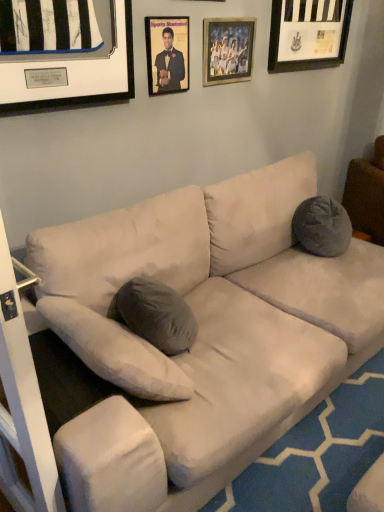
Question: Could you tell me if wooden picture frame at upper center, the second picture frame positioned from the left, is turned towards matte black frame at upper center, which ranks as the 1th picture frame in left-to-right order?

Choices:
 (A) no
 (B) yes

Answer: (A)

Question: Can you confirm if wooden picture frame at upper center, the second picture frame positioned from the left, is shorter than matte black frame at upper center, which is the 3th picture frame in right-to-left order?

Choices:
 (A) no
 (B) yes

Answer: (B)

Question: From the image's perspective, is wooden picture frame at upper center, which appears as the second picture frame when viewed from the right, beneath matte black frame at upper center, which is the 3th picture frame in right-to-left order?

Choices:
 (A) yes
 (B) no

Answer: (B)

Question: Is matte black frame at upper center, which ranks as the 1th picture frame in left-to-right order, located within wooden picture frame at upper center, the second picture frame positioned from the left?

Choices:
 (A) yes
 (B) no

Answer: (B)

Question: Does wooden picture frame at upper center, which appears as the second picture frame when viewed from the right, come in front of matte black frame at upper center, which is the 3th picture frame in right-to-left order?

Choices:
 (A) yes
 (B) no

Answer: (B)

Question: Would you say wooden picture frame at upper center, the second picture frame positioned from the left, is outside matte black frame at upper center, which is the 3th picture frame in right-to-left order?

Choices:
 (A) no
 (B) yes

Answer: (B)

Question: From a real-world perspective, is matte black frame at upper center, which is the 3th picture frame in right-to-left order, located higher than wooden picture frame at upper center, which appears as the second picture frame when viewed from the right?

Choices:
 (A) no
 (B) yes

Answer: (A)

Question: Can you confirm if matte black frame at upper center, which ranks as the 1th picture frame in left-to-right order, is positioned to the right of wooden picture frame at upper center, which appears as the second picture frame when viewed from the right?

Choices:
 (A) no
 (B) yes

Answer: (A)

Question: From the image's perspective, is matte black frame at upper center, which ranks as the 1th picture frame in left-to-right order, on top of wooden picture frame at upper center, which appears as the second picture frame when viewed from the right?

Choices:
 (A) no
 (B) yes

Answer: (A)

Question: Considering the relative sizes of matte black frame at upper center, which ranks as the 1th picture frame in left-to-right order, and wooden picture frame at upper center, the second picture frame positioned from the left, in the image provided, is matte black frame at upper center, which ranks as the 1th picture frame in left-to-right order, smaller than wooden picture frame at upper center, the second picture frame positioned from the left,?

Choices:
 (A) no
 (B) yes

Answer: (B)

Question: From the image's perspective, is matte black frame at upper center, which is the 3th picture frame in right-to-left order, beneath wooden picture frame at upper center, the second picture frame positioned from the left?

Choices:
 (A) yes
 (B) no

Answer: (A)

Question: Does matte black frame at upper center, which is the 3th picture frame in right-to-left order, turn towards wooden picture frame at upper center, which appears as the second picture frame when viewed from the right?

Choices:
 (A) no
 (B) yes

Answer: (A)

Question: Considering the relative positions of gray fabric pillow at right and black matte picture frame at upper right, which is the 3th picture frame from left to right, in the image provided, is gray fabric pillow at right to the right of black matte picture frame at upper right, which is the 3th picture frame from left to right, from the viewer's perspective?

Choices:
 (A) yes
 (B) no

Answer: (A)